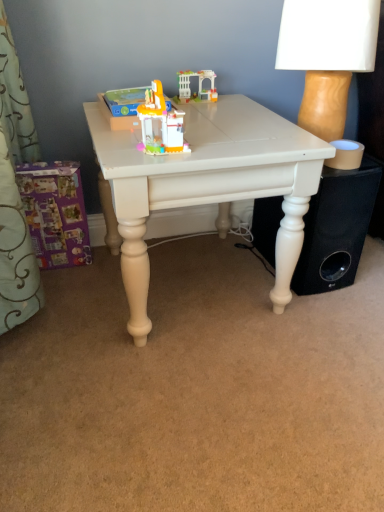
Where is `vacant area that is in front of translucent plastic toy at center, which ranks as the third toy in back-to-front order`? The height and width of the screenshot is (512, 384). vacant area that is in front of translucent plastic toy at center, which ranks as the third toy in back-to-front order is located at coordinates (119, 137).